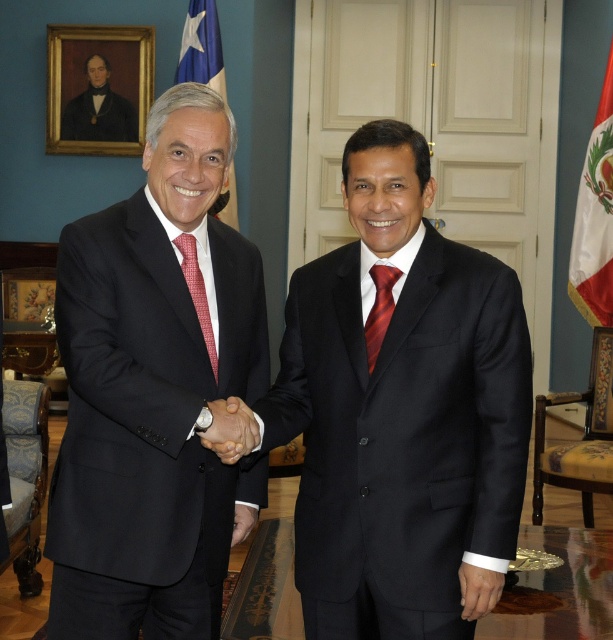
Based on the scene description, where is the black matte suit at center located in terms of coordinates?

The black matte suit at center is located at coordinates point (402, 412).

You are a photographer standing at the point marked as point (368, 346). You want to take a photo of the two men shaking hands. Can you fit both of them in the frame if your camera has a 10 feet wide field of view?

The two men are 6.50 feet apart, so yes, the photographer can fit both of them in the frame since the distance between them is less than the camera field of view of 10 feet.